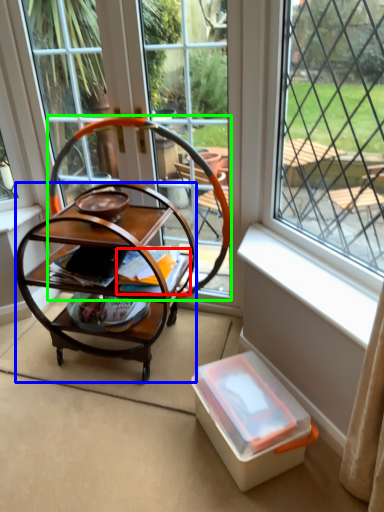
Question: Which object is the closest to the magazine (highlighted by a red box)? Choose among these: desk (highlighted by a blue box) or rocking chair (highlighted by a green box).

Choices:
 (A) desk
 (B) rocking chair

Answer: (A)